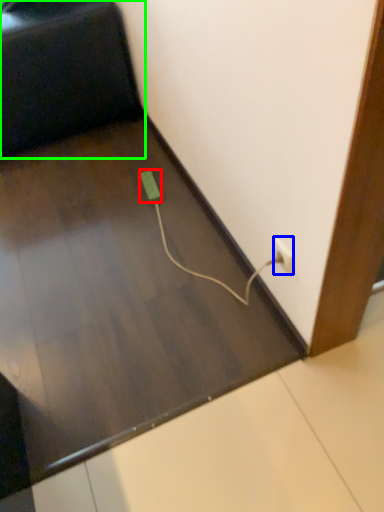
Question: Which object is positioned closest to socket (highlighted by a red box)? Select from power plugs and sockets (highlighted by a blue box) and furniture (highlighted by a green box).

Choices:
 (A) power plugs and sockets
 (B) furniture

Answer: (B)